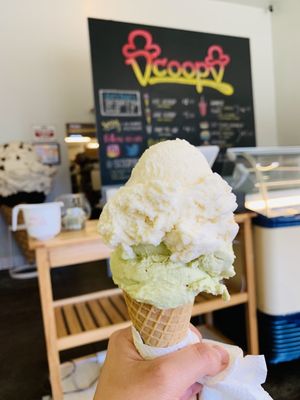
The image size is (300, 400). What are the coordinates of `towel` in the screenshot? It's located at (248, 377).